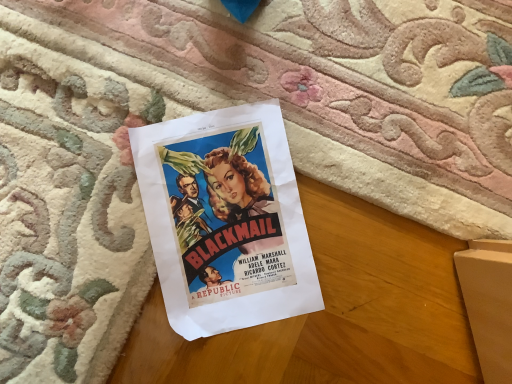
The width and height of the screenshot is (512, 384). What do you see at coordinates (225, 220) in the screenshot? I see `matte paper poster at center` at bounding box center [225, 220].

The width and height of the screenshot is (512, 384). Find the location of `matte paper poster at center`. matte paper poster at center is located at coordinates (225, 220).

In order to face matte paper poster at center, should I rotate leftwards or rightwards?

Rotate your view left by about 5.431°.

Locate an element on the screen. Image resolution: width=512 pixels, height=384 pixels. matte paper poster at center is located at coordinates (225, 220).